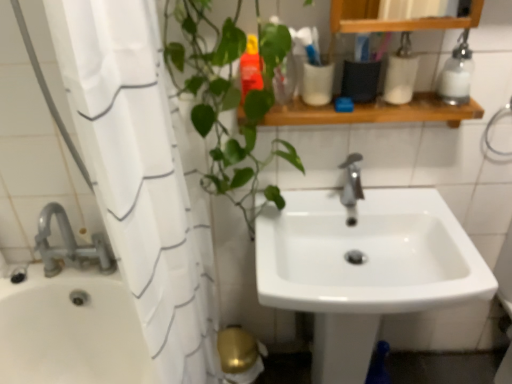
Question: Considering the relative sizes of white glossy container at upper right, the first toiletry viewed from the right, and clear glass soap dispenser at upper right in the image provided, is white glossy container at upper right, the first toiletry viewed from the right, smaller than clear glass soap dispenser at upper right?

Choices:
 (A) yes
 (B) no

Answer: (A)

Question: Considering the relative positions of white glossy container at upper right, which ranks as the second toiletry in left-to-right order, and clear glass soap dispenser at upper right in the image provided, is white glossy container at upper right, which ranks as the second toiletry in left-to-right order, to the left of clear glass soap dispenser at upper right from the viewer's perspective?

Choices:
 (A) no
 (B) yes

Answer: (B)

Question: Considering the relative positions of white glossy container at upper right, which ranks as the second toiletry in left-to-right order, and clear glass soap dispenser at upper right in the image provided, is white glossy container at upper right, which ranks as the second toiletry in left-to-right order, in front of clear glass soap dispenser at upper right?

Choices:
 (A) no
 (B) yes

Answer: (A)

Question: From the image's perspective, is white glossy container at upper right, the first toiletry viewed from the right, beneath clear glass soap dispenser at upper right?

Choices:
 (A) no
 (B) yes

Answer: (B)

Question: From the image's perspective, is white glossy container at upper right, which ranks as the second toiletry in left-to-right order, above clear glass soap dispenser at upper right?

Choices:
 (A) no
 (B) yes

Answer: (A)

Question: Considering the positions of point (262, 87) and point (392, 87), is point (262, 87) closer or farther from the camera than point (392, 87)?

Choices:
 (A) farther
 (B) closer

Answer: (B)

Question: From the image's perspective, is translucent orange bottle at upper center, placed as the second toiletry when sorted from right to left, above or below white glossy container at upper right, which ranks as the second toiletry in left-to-right order?

Choices:
 (A) below
 (B) above

Answer: (A)

Question: Based on their sizes in the image, would you say translucent orange bottle at upper center, positioned as the 1th toiletry in left-to-right order, is bigger or smaller than white glossy container at upper right, which ranks as the second toiletry in left-to-right order?

Choices:
 (A) big
 (B) small

Answer: (B)

Question: Would you say translucent orange bottle at upper center, positioned as the 1th toiletry in left-to-right order, is to the left or to the right of white glossy container at upper right, which ranks as the second toiletry in left-to-right order, in the picture?

Choices:
 (A) left
 (B) right

Answer: (A)

Question: From the image's perspective, is white glossy sink at center positioned above or below wooden shelf at upper center?

Choices:
 (A) above
 (B) below

Answer: (B)

Question: Is white glossy sink at center wider or thinner than wooden shelf at upper center?

Choices:
 (A) wide
 (B) thin

Answer: (A)

Question: Is white glossy sink at center to the left or to the right of wooden shelf at upper center in the image?

Choices:
 (A) right
 (B) left

Answer: (A)

Question: Considering their positions, is white glossy sink at center located in front of or behind wooden shelf at upper center?

Choices:
 (A) front
 (B) behind

Answer: (A)

Question: From the image's perspective, is white glossy sink at center above or below white fabric shower curtain at left?

Choices:
 (A) above
 (B) below

Answer: (B)

Question: Is white glossy sink at center in front of or behind white fabric shower curtain at left in the image?

Choices:
 (A) behind
 (B) front

Answer: (A)